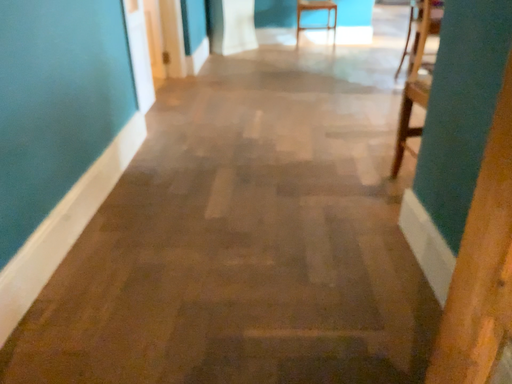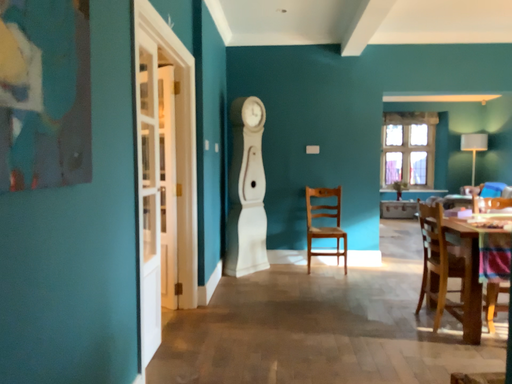
Question: Which way did the camera rotate in the video?

Choices:
 (A) rotated downward
 (B) rotated upward

Answer: (B)